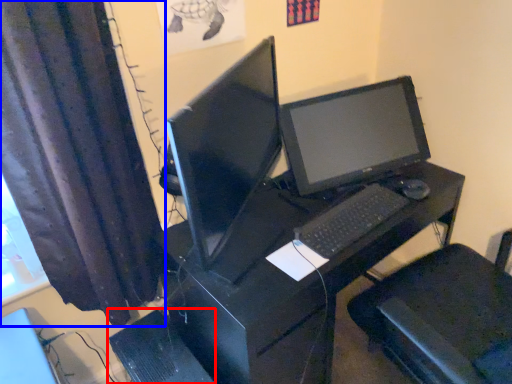
Question: Among these objects, which one is farthest to the camera, computer tower (highlighted by a red box) or curtain (highlighted by a blue box)?

Choices:
 (A) computer tower
 (B) curtain

Answer: (A)